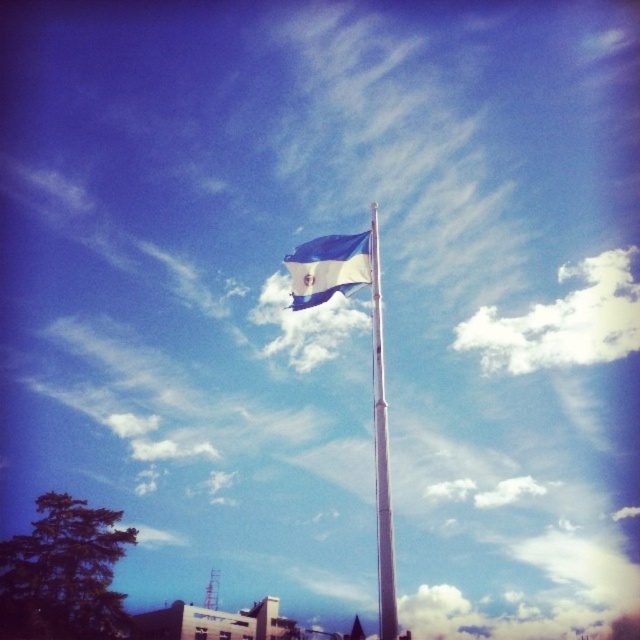
Which is below, white metallic pole at center or blue fabric flag at upper center?

white metallic pole at center is lower down.

Does white metallic pole at center appear on the right side of blue fabric flag at upper center?

Indeed, white metallic pole at center is positioned on the right side of blue fabric flag at upper center.

Does point (372, 412) come in front of point (337, 289)?

No.

At what (x,y) coordinates should I click in order to perform the action: click on white metallic pole at center. Please return your answer as a coordinate pair (x, y). Looking at the image, I should click on (381, 456).